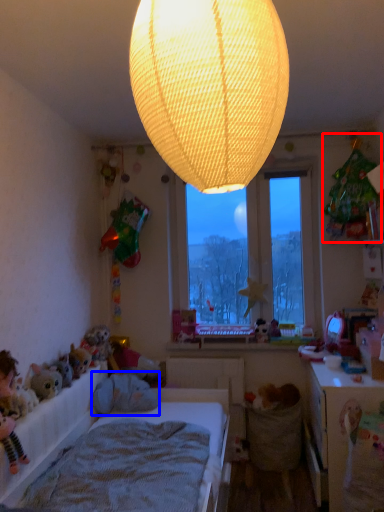
Question: Which point is closer to the camera, toy (highlighted by a red box) or animal (highlighted by a blue box)?

Choices:
 (A) toy
 (B) animal

Answer: (A)